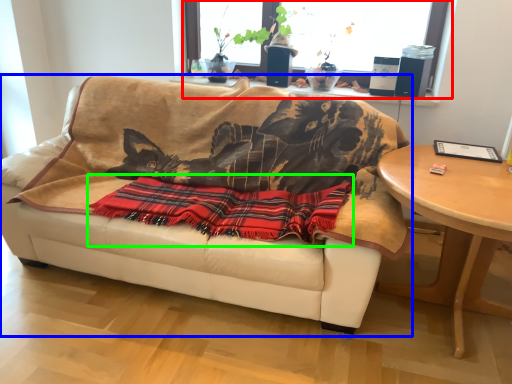
Question: Which object is positioned closest to window (highlighted by a red box)? Select from studio couch (highlighted by a blue box) and blanket (highlighted by a green box).

Choices:
 (A) studio couch
 (B) blanket

Answer: (A)